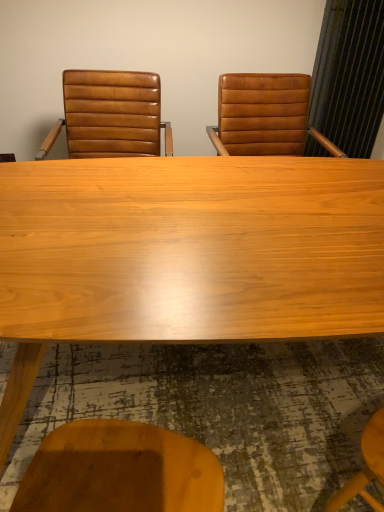
Question: From the image's perspective, is brown leather chair at left located above light wood table at center?

Choices:
 (A) yes
 (B) no

Answer: (A)

Question: Is brown leather chair at left looking in the opposite direction of light wood table at center?

Choices:
 (A) no
 (B) yes

Answer: (A)

Question: Is brown leather chair at left wider than light wood table at center?

Choices:
 (A) no
 (B) yes

Answer: (A)

Question: Is brown leather chair at left oriented towards light wood table at center?

Choices:
 (A) yes
 (B) no

Answer: (A)

Question: Does brown leather chair at left have a lesser height compared to light wood table at center?

Choices:
 (A) yes
 (B) no

Answer: (A)

Question: From a real-world perspective, does brown leather chair at left sit lower than light wood table at center?

Choices:
 (A) yes
 (B) no

Answer: (B)

Question: Is light wood table at center shorter than brown leather chair at left?

Choices:
 (A) yes
 (B) no

Answer: (B)

Question: Is light wood table at center taller than brown leather chair at left?

Choices:
 (A) yes
 (B) no

Answer: (A)

Question: Is light wood table at center wider than brown leather chair at left?

Choices:
 (A) yes
 (B) no

Answer: (A)

Question: Is light wood table at center bigger than brown leather chair at left?

Choices:
 (A) yes
 (B) no

Answer: (A)

Question: Is light wood table at center to the right of brown leather chair at left from the viewer's perspective?

Choices:
 (A) no
 (B) yes

Answer: (B)

Question: From the image's perspective, is light wood table at center located above brown leather chair at left?

Choices:
 (A) yes
 (B) no

Answer: (B)

Question: Would you say light wood table at center is to the left or to the right of brown leather chair at left in the picture?

Choices:
 (A) left
 (B) right

Answer: (B)